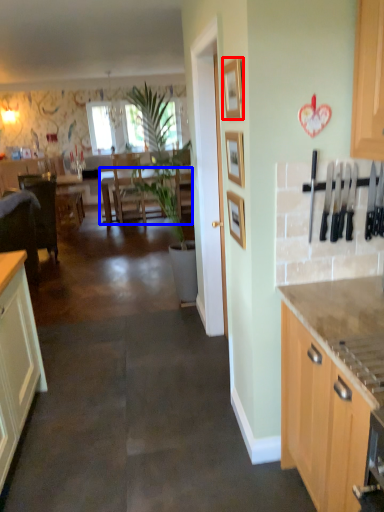
Question: Which point is closer to the camera, picture frame (highlighted by a red box) or table (highlighted by a blue box)?

Choices:
 (A) picture frame
 (B) table

Answer: (A)